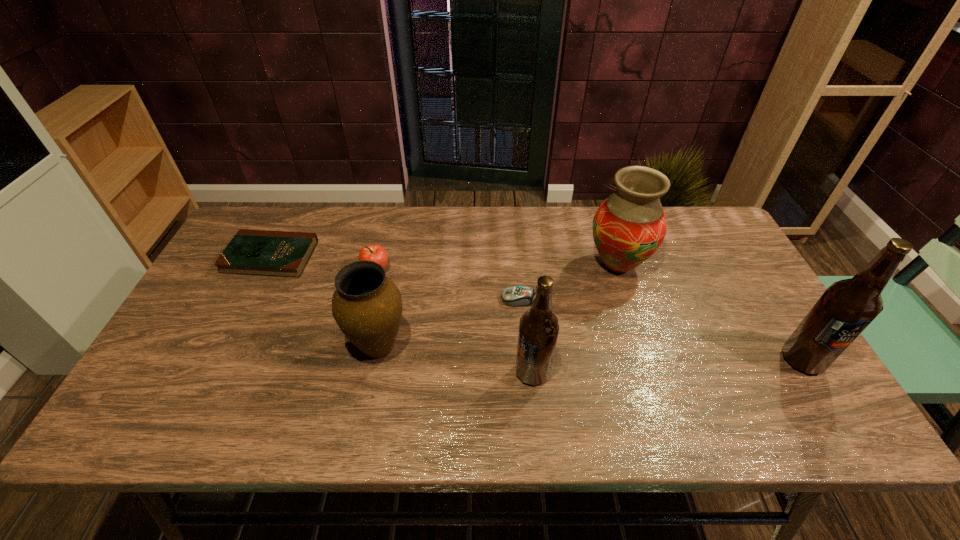
Where is `the left beer bottle`? the left beer bottle is located at coordinates (538, 329).

I want to click on the rightmost object, so pyautogui.click(x=847, y=307).

Image resolution: width=960 pixels, height=540 pixels. Identify the location of the tallest object. (847, 307).

The image size is (960, 540). I want to click on the third shortest object, so click(375, 252).

Identify the location of vase. This screenshot has width=960, height=540. (629, 226).

Where is `the leftmost object`? The image size is (960, 540). the leftmost object is located at coordinates (250, 252).

Where is `urn`? This screenshot has width=960, height=540. urn is located at coordinates (367, 306).

Image resolution: width=960 pixels, height=540 pixels. Find the location of `computer mouse`. computer mouse is located at coordinates pos(515,296).

Image resolution: width=960 pixels, height=540 pixels. Find the location of `vacant region located on the label of the shorter beer bottle`. vacant region located on the label of the shorter beer bottle is located at coordinates (415, 373).

Locate an element on the screen. Image resolution: width=960 pixels, height=540 pixels. free spot located on the label of the shorter beer bottle is located at coordinates (457, 373).